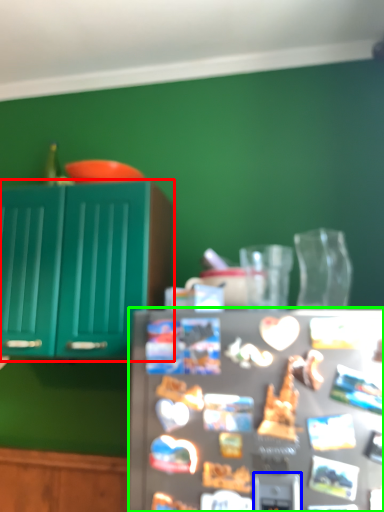
Question: Which object is the closest to the cabinetry (highlighted by a red box)? Choose among these: appliance (highlighted by a blue box) or refrigerator (highlighted by a green box).

Choices:
 (A) appliance
 (B) refrigerator

Answer: (B)